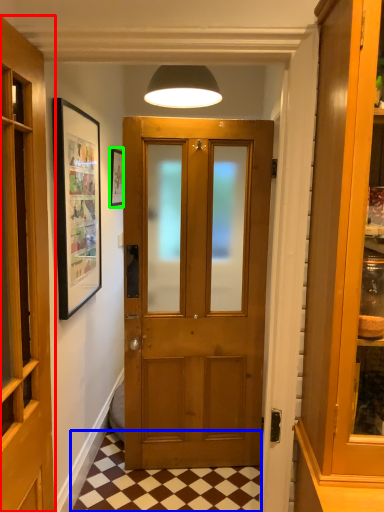
Question: Considering the real-world distances, which object is closest to door (highlighted by a red box)? tile (highlighted by a blue box) or picture frame (highlighted by a green box).

Choices:
 (A) tile
 (B) picture frame

Answer: (A)